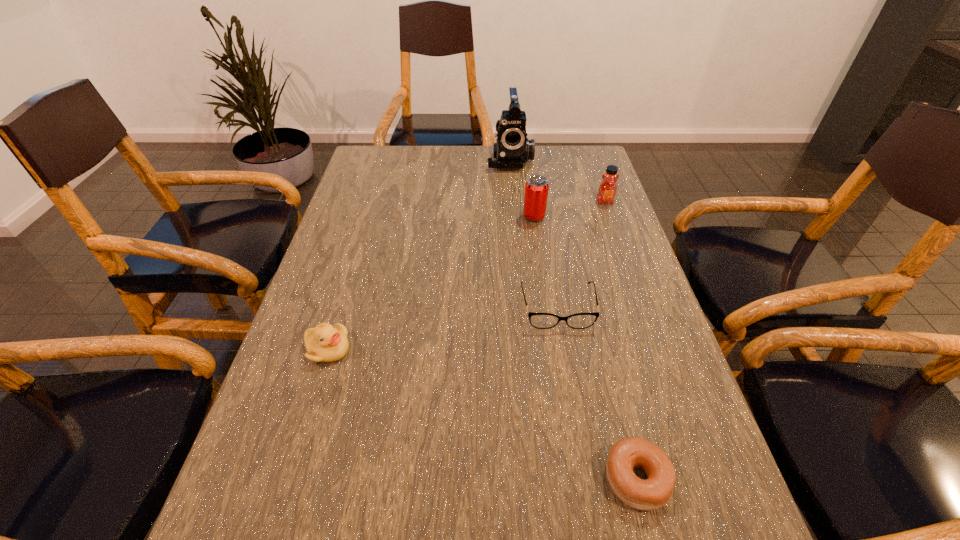
This screenshot has width=960, height=540. I want to click on vacant area at the far edge of the desktop, so click(434, 146).

This screenshot has height=540, width=960. I want to click on vacant region at the left edge of the desktop, so click(x=266, y=450).

You are a GUI agent. You are given a task and a screenshot of the screen. Output one action in this format:
    pyautogui.click(x=<x>, y=<y>)
    Task: Click on the free space at the right edge of the desktop
    The image size is (960, 540).
    Given the screenshot: What is the action you would take?
    pyautogui.click(x=609, y=289)

In order to click on free region at the far right corner of the desktop in this screenshot , I will do `click(561, 153)`.

You are a GUI agent. You are given a task and a screenshot of the screen. Output one action in this format:
    pyautogui.click(x=<x>, y=<y>)
    Task: Click on the free spot between the spectacles and the second nearest object
    The height and width of the screenshot is (540, 960).
    Given the screenshot: What is the action you would take?
    pyautogui.click(x=443, y=328)

The height and width of the screenshot is (540, 960). What are the coordinates of `free space between the honey and the bagel` in the screenshot? It's located at (621, 340).

The height and width of the screenshot is (540, 960). I want to click on free space between the spectacles and the soda can, so click(x=546, y=262).

Where is `vacant point located between the second farthest object and the leftmost object`? This screenshot has width=960, height=540. vacant point located between the second farthest object and the leftmost object is located at coordinates (467, 275).

Where is `free area in between the soda can and the second nearest object`? This screenshot has width=960, height=540. free area in between the soda can and the second nearest object is located at coordinates (431, 283).

This screenshot has width=960, height=540. Find the location of `empty space that is in between the third nearest object and the farthest object`. empty space that is in between the third nearest object and the farthest object is located at coordinates (534, 233).